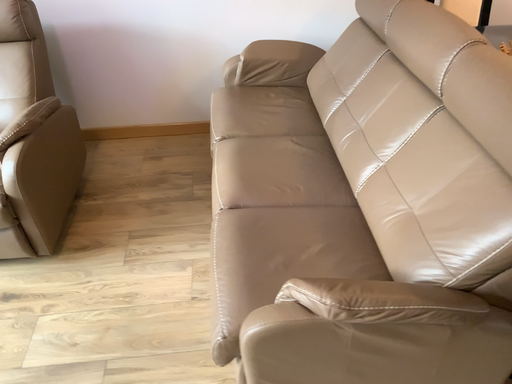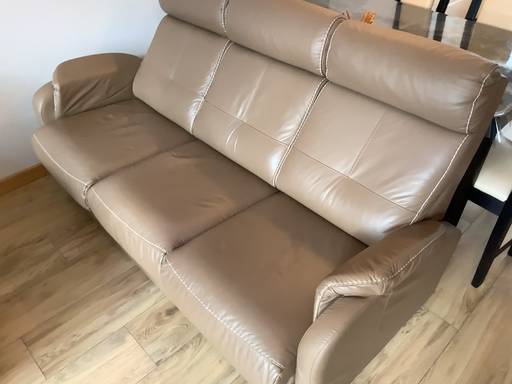
Question: How did the camera likely rotate when shooting the video?

Choices:
 (A) rotated right
 (B) rotated left

Answer: (A)